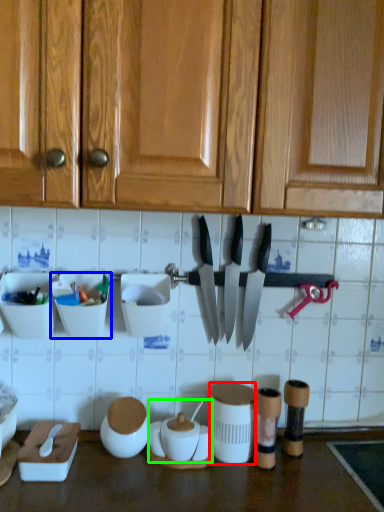
Question: Which object is the farthest from tableware (highlighted by a red box)? Choose among these: tableware (highlighted by a blue box) or pottery (highlighted by a green box).

Choices:
 (A) tableware
 (B) pottery

Answer: (A)